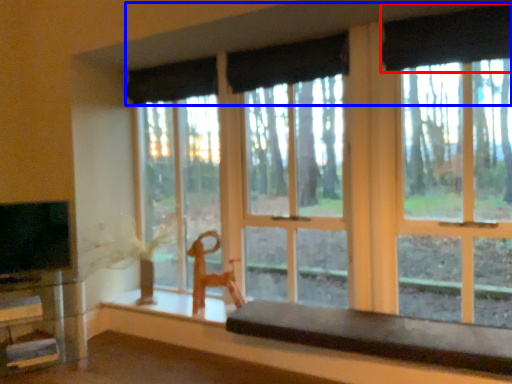
Question: Which point is closer to the camera, curtain (highlighted by a red box) or curtain (highlighted by a blue box)?

Choices:
 (A) curtain
 (B) curtain

Answer: (B)